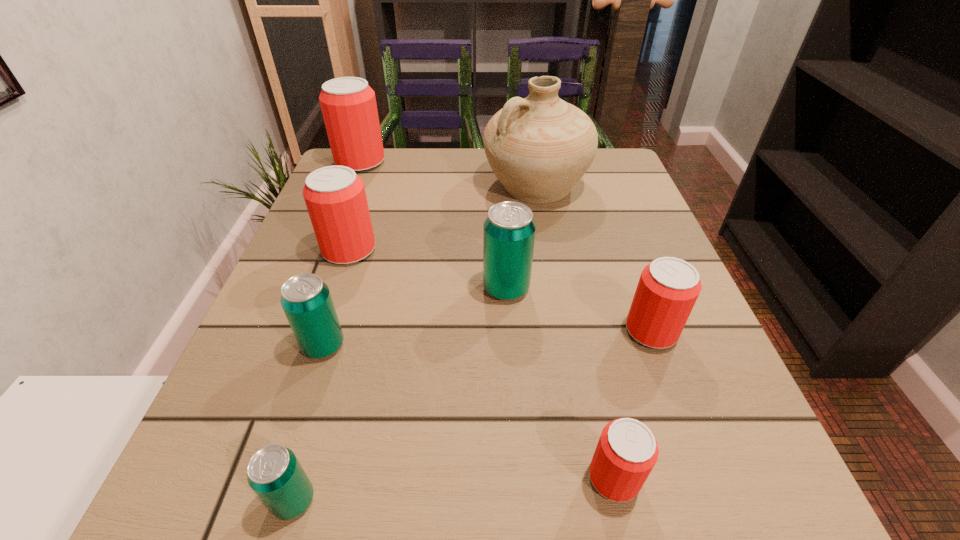
Where is `vacant area situated on the back of the nearest teal beer can`? The width and height of the screenshot is (960, 540). vacant area situated on the back of the nearest teal beer can is located at coordinates (329, 378).

Locate an element on the screen. The height and width of the screenshot is (540, 960). pottery that is positioned at the far edge is located at coordinates (539, 147).

Locate an element on the screen. beer can present at the far edge is located at coordinates tap(348, 104).

Where is `pottery situated at the right edge`? pottery situated at the right edge is located at coordinates (539, 147).

Where is `beer can present at the right edge`? beer can present at the right edge is located at coordinates (668, 288).

Locate an element on the screen. The height and width of the screenshot is (540, 960). object that is positioned at the far left corner is located at coordinates (348, 104).

The width and height of the screenshot is (960, 540). Identify the location of object located in the near left corner section of the desktop. (274, 473).

Locate an element on the screen. Image resolution: width=960 pixels, height=540 pixels. object located at the far right corner is located at coordinates (539, 147).

Locate an element on the screen. The width and height of the screenshot is (960, 540). vacant space at the far edge is located at coordinates (446, 160).

At what (x,y) coordinates should I click in order to perform the action: click on vacant position at the near edge of the desktop. Please return your answer as a coordinate pair (x, y). The width and height of the screenshot is (960, 540). Looking at the image, I should click on point(333,460).